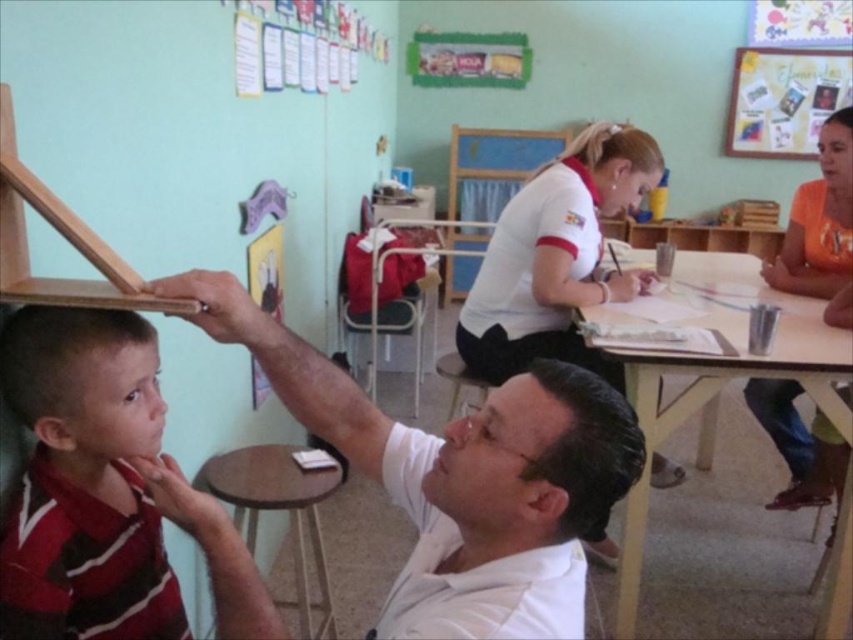
Is orange cotton shirt at right below light brown wood easel at upper left?

No, orange cotton shirt at right is not below light brown wood easel at upper left.

Locate an element on the screen. orange cotton shirt at right is located at coordinates (819, 220).

Who is more distant from viewer, (605,493) or (0,115)?

Positioned behind is point (0,115).

Which of these two, white matte shirt at upper center or light brown wood easel at upper left, stands taller?

white matte shirt at upper center

The height and width of the screenshot is (640, 853). In order to click on white matte shirt at upper center in this screenshot , I will do `click(457, 465)`.

Does white matte shirt at upper center have a greater height compared to striped fabric shirt at left?

In fact, white matte shirt at upper center may be shorter than striped fabric shirt at left.

Is point (544, 544) farther from viewer compared to point (131, 595)?

No, (544, 544) is closer to viewer.

Who is more distant from viewer, (401,442) or (219,596)?

The point (401,442) is more distant.

What are the coordinates of `white matte shirt at upper center` in the screenshot? It's located at (457, 465).